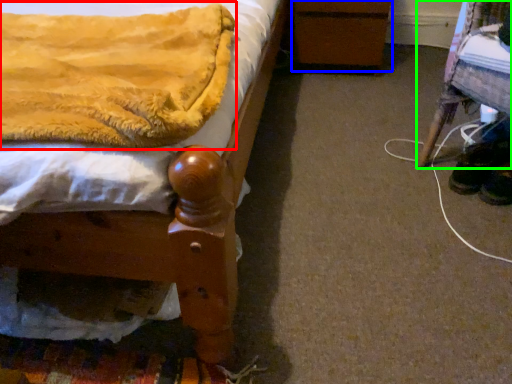
Question: Which is farther away from blanket (highlighted by a red box)? changing table (highlighted by a blue box) or furniture (highlighted by a green box)?

Choices:
 (A) changing table
 (B) furniture

Answer: (A)